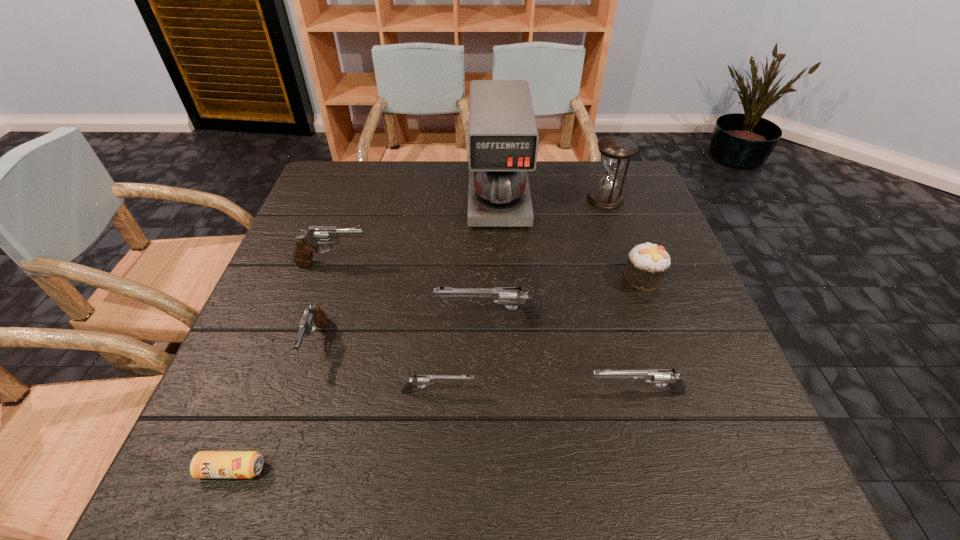
At what (x,y) coordinates should I click in order to perform the action: click on vacant space at the far right corner of the desktop. Please return your answer as a coordinate pair (x, y). The height and width of the screenshot is (540, 960). Looking at the image, I should click on (632, 187).

At what (x,y) coordinates should I click in order to perform the action: click on vacant space in between the coffee maker and the smaller gray pistol. Please return your answer as a coordinate pair (x, y). The width and height of the screenshot is (960, 540). Looking at the image, I should click on (407, 268).

You are a GUI agent. You are given a task and a screenshot of the screen. Output one action in this format:
    pyautogui.click(x=<x>, y=<y>)
    Task: Click on the free space between the tallest object and the smaller gray pistol
    
    Given the screenshot: What is the action you would take?
    pyautogui.click(x=407, y=268)

Locate an element on the screen. The image size is (960, 540). unoccupied position between the hourglass and the cupcake is located at coordinates (624, 238).

Where is `free space between the shortest object and the second tallest object`? Image resolution: width=960 pixels, height=540 pixels. free space between the shortest object and the second tallest object is located at coordinates (419, 334).

This screenshot has height=540, width=960. What are the coordinates of `blank region between the second shortest object and the nearest object` in the screenshot? It's located at (335, 431).

Where is `free space between the second tallest object and the nearer gray pistol`? The height and width of the screenshot is (540, 960). free space between the second tallest object and the nearer gray pistol is located at coordinates (461, 271).

Locate an element on the screen. vacant point located between the farthest pistol and the hourglass is located at coordinates [x=469, y=231].

Find the location of a particular element. The image size is (960, 540). free space between the nearer gray pistol and the eighth tallest object is located at coordinates (377, 367).

Locate an element on the screen. free space that is in between the eighth shortest object and the rightmost silver pistol is located at coordinates (620, 296).